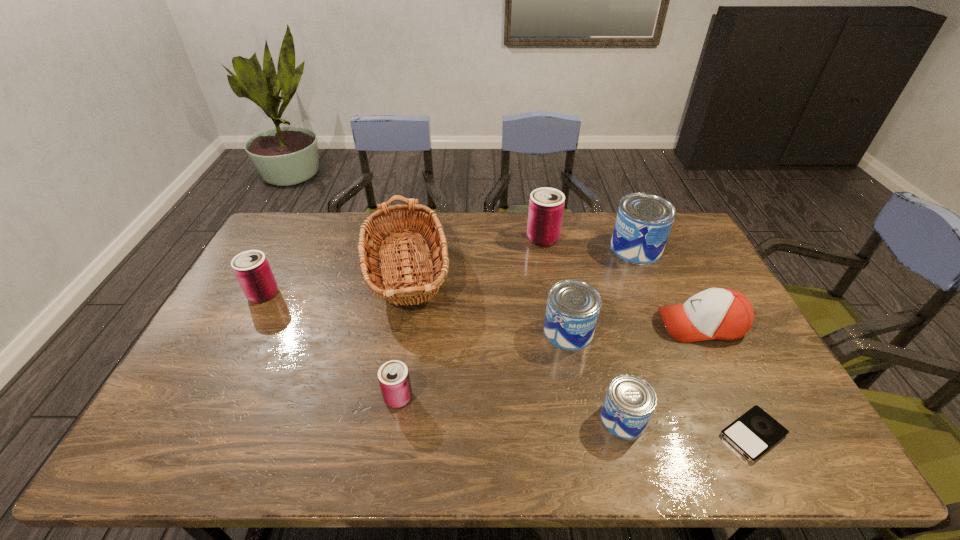
Locate an element on the screen. free space located 0.230m on the right of the leftmost can is located at coordinates (351, 294).

Where is `vacant space situated on the front label of the second biggest blue can`? The width and height of the screenshot is (960, 540). vacant space situated on the front label of the second biggest blue can is located at coordinates (588, 431).

What are the coordinates of `blank space located on the front-facing side of the baseball cap` in the screenshot? It's located at (536, 325).

Locate an element on the screen. free space located on the front-facing side of the baseball cap is located at coordinates (580, 325).

I want to click on free region located on the front-facing side of the baseball cap, so click(611, 325).

I want to click on free region located 0.100m on the right of the nearest pink can, so click(452, 397).

This screenshot has height=540, width=960. Find the location of `free space located 0.370m on the back of the iPod`. free space located 0.370m on the back of the iPod is located at coordinates (688, 302).

Where is `basket located in the far edge section of the desktop`? This screenshot has width=960, height=540. basket located in the far edge section of the desktop is located at coordinates (395, 289).

Identify the location of can that is at the near edge. This screenshot has width=960, height=540. (630, 401).

What are the coordinates of `iPod that is at the near edge` in the screenshot? It's located at click(755, 432).